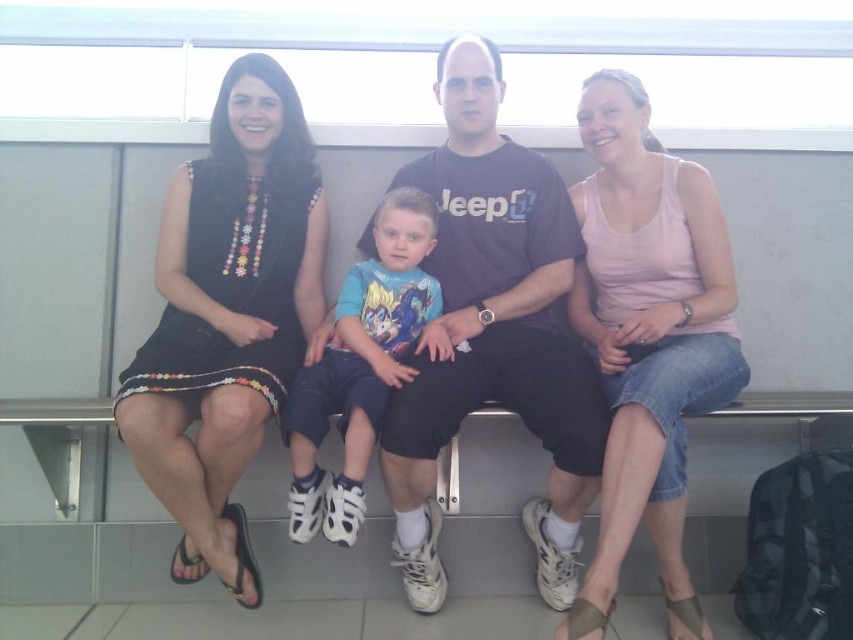
Question: Estimate the real-world distances between objects in this image. Which object is farther from the blue cotton shirt at center?

Choices:
 (A) pink cotton tank top at center
 (B) black fabric dress at left

Answer: (A)

Question: Which point appears farthest from the camera in this image?

Choices:
 (A) (582, 604)
 (B) (302, 326)
 (C) (393, 508)
 (D) (341, 292)

Answer: (B)

Question: Is matte black dress at left wider than black cotton t-shirt at center?

Choices:
 (A) yes
 (B) no

Answer: (A)

Question: Can you confirm if black fabric dress at left is smaller than pink cotton tank top at center?

Choices:
 (A) no
 (B) yes

Answer: (B)

Question: Is black fabric dress at left to the right of black cotton t-shirt at center from the viewer's perspective?

Choices:
 (A) yes
 (B) no

Answer: (B)

Question: Which point is closer to the camera?

Choices:
 (A) (178, 465)
 (B) (593, 198)
 (C) (664, 518)

Answer: (A)